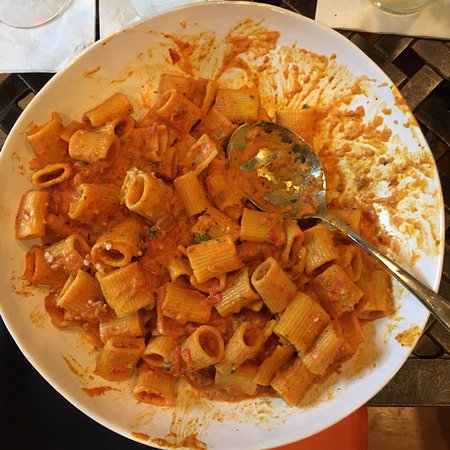
Locate an element on the screen. table top is located at coordinates (420, 377).